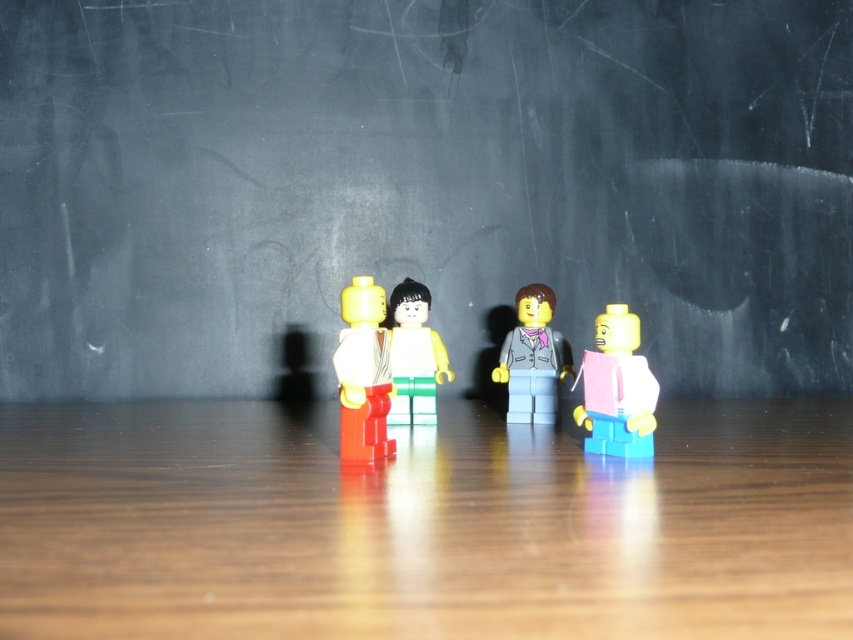
Who is lower down, matte pink book at right or matte plastic minifigure at center?

matte pink book at right is below.

Is matte pink book at right to the left of matte plastic minifigure at center from the viewer's perspective?

In fact, matte pink book at right is to the right of matte plastic minifigure at center.

Who is more distant from viewer, (605, 387) or (370, 388)?

The point (605, 387) is more distant.

Locate an element on the screen. Image resolution: width=853 pixels, height=640 pixels. matte pink book at right is located at coordinates (618, 388).

Is matte plastic minifigure at center bigger than matte yellow minifigure at center?

Indeed, matte plastic minifigure at center has a larger size compared to matte yellow minifigure at center.

Which is in front, point (381, 388) or point (434, 353)?

Positioned in front is point (381, 388).

The height and width of the screenshot is (640, 853). Describe the element at coordinates (363, 372) in the screenshot. I see `matte plastic minifigure at center` at that location.

I want to click on matte plastic minifigure at center, so click(x=363, y=372).

Can you confirm if matte plastic minifigure at center is bigger than matte gray suit at center?

Actually, matte plastic minifigure at center might be smaller than matte gray suit at center.

Does point (358, 374) come farther from viewer compared to point (548, 326)?

No, it is in front of (548, 326).

Locate an element on the screen. matte plastic minifigure at center is located at coordinates (363, 372).

Find the location of a particular element. Image resolution: width=853 pixels, height=640 pixels. matte plastic minifigure at center is located at coordinates (363, 372).